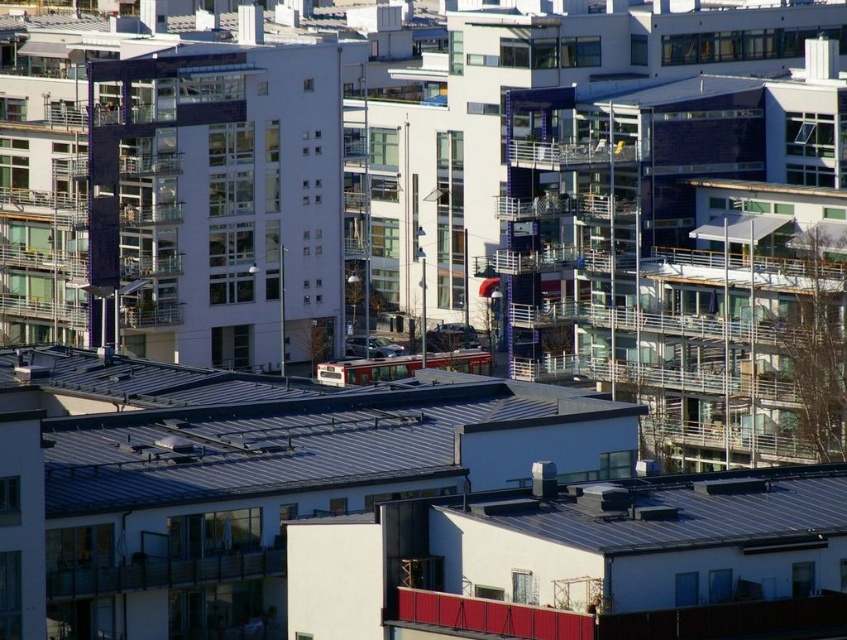
Describe the element at coordinates (270, 445) in the screenshot. The height and width of the screenshot is (640, 847). I see `metallic gray roof at center` at that location.

Between point (53, 522) and point (491, 504), which one is positioned in front?

Point (491, 504) is in front.

Where is `metallic gray roof at center`? metallic gray roof at center is located at coordinates (270, 445).